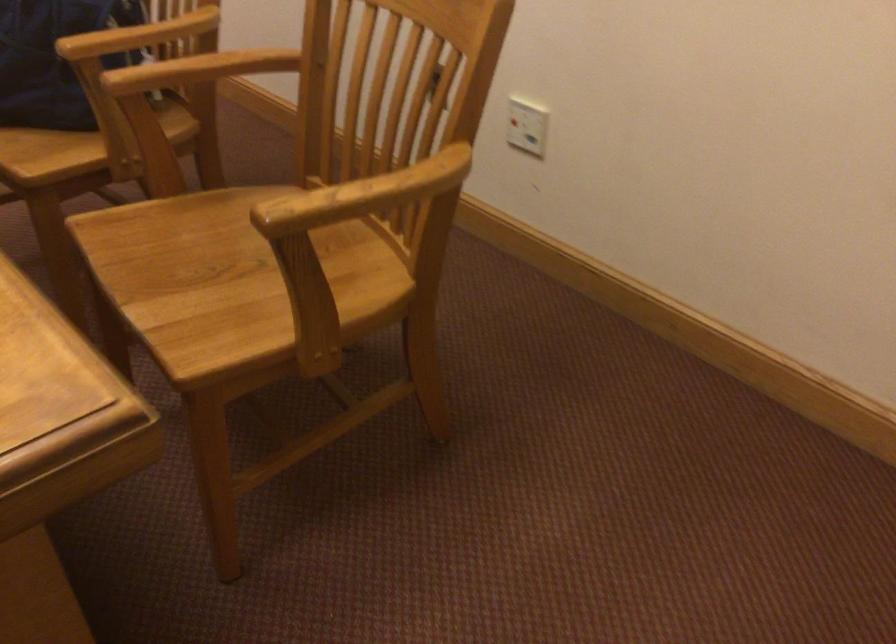
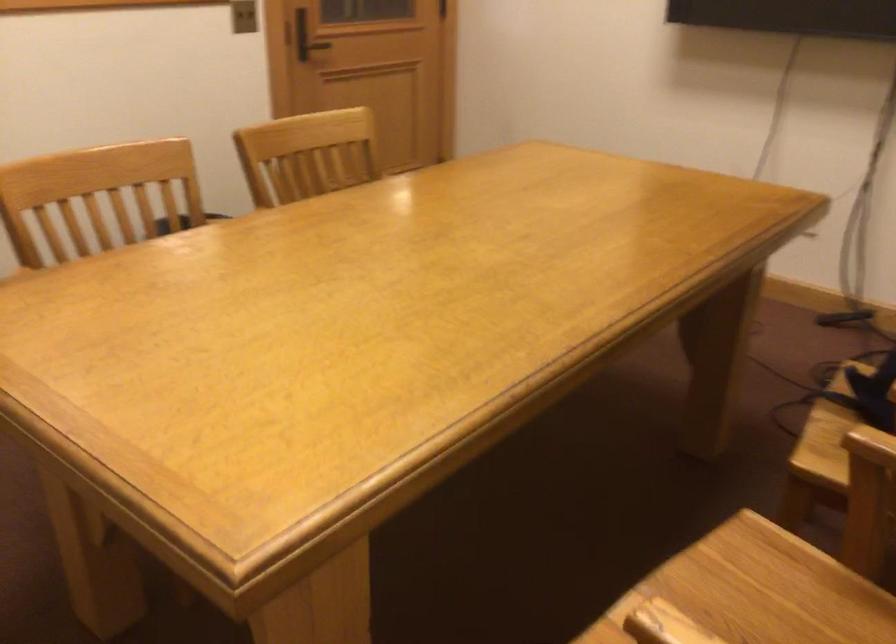
Find the pixel in the second image that matches point (158, 234) in the first image.

(764, 588)